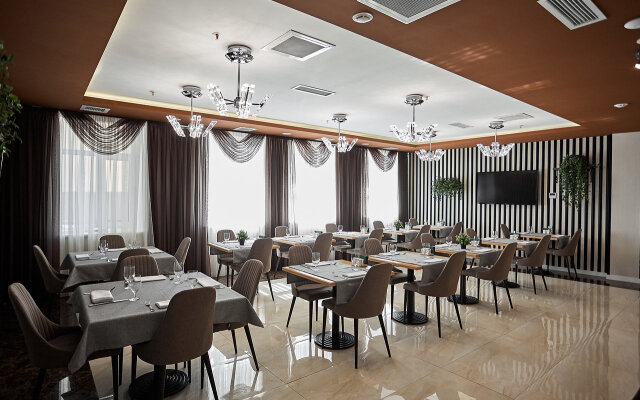
This screenshot has width=640, height=400. In order to click on indoor foliage decoration in this screenshot , I will do `click(241, 236)`, `click(397, 224)`, `click(464, 240)`, `click(573, 173)`, `click(454, 184)`, `click(11, 108)`.